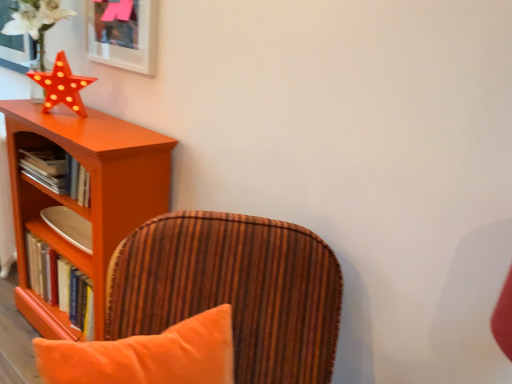
The width and height of the screenshot is (512, 384). What are the coordinates of `vacant space in front of matte orange star at upper left` in the screenshot? It's located at (58, 130).